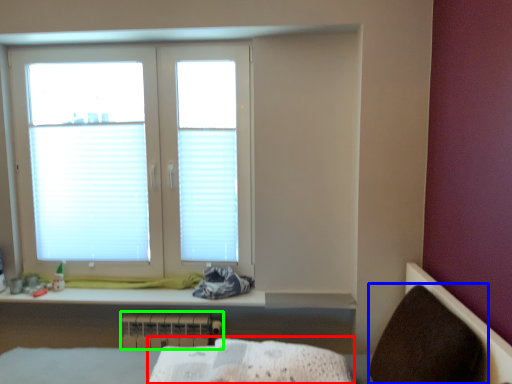
Question: Which is farther away from sheet (highlighted by a red box)? armchair (highlighted by a blue box) or radiator (highlighted by a green box)?

Choices:
 (A) armchair
 (B) radiator

Answer: (B)